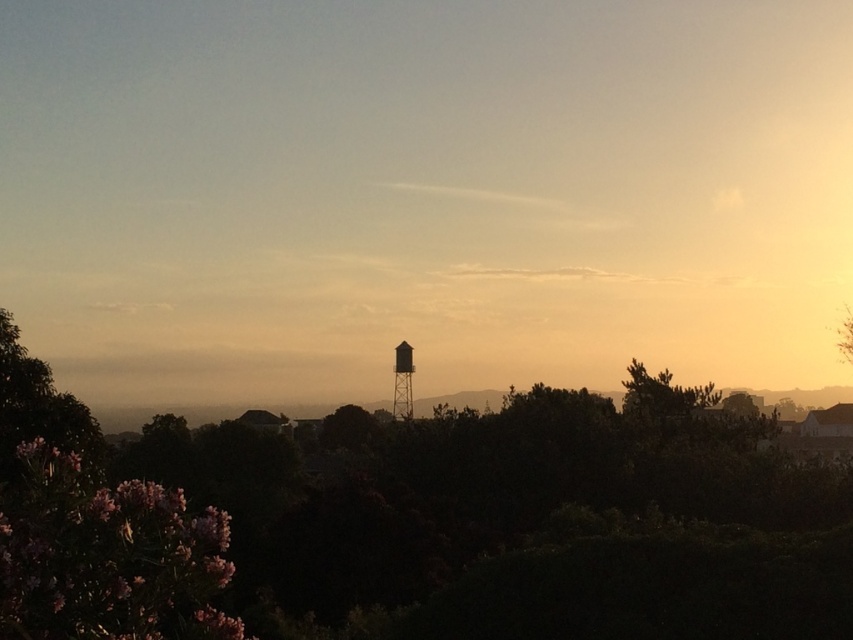
Based on the photo, you are an artist setting up your easel to paint the serene landscape. You want to ensure that the pink matte flowers at lower left and the silvery metallic water tower at center are proportionally accurate in your painting. Which object should you make smaller in your artwork?

The pink matte flowers at lower left should be made smaller in the artwork since they have a lesser width compared to the silvery metallic water tower at center.